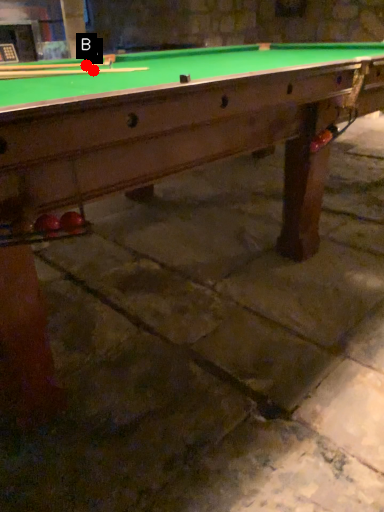
Question: Two points are circled on the image, labeled by A and B beside each circle. Which point appears farthest from the camera in this image?

Choices:
 (A) A is further
 (B) B is further

Answer: (B)